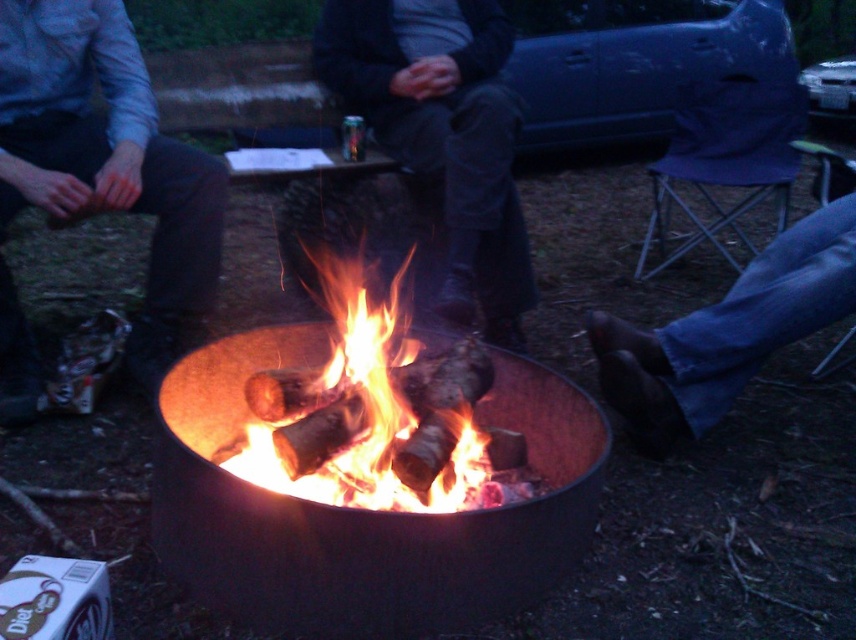
You are standing in the outdoor scene with the fire pit. There are two points marked in the image. Which point is closer to you, point [10,80] or point [348,420]?

Point [10,80] is closer to you because it is further to the viewer than point [348,420].

You are planning to place a decorative stone on the black metal fire pit at center. However, you notice the dark gray sweater at center nearby. Which object is larger in size, making it more suitable to place the stone on?

The dark gray sweater at center is larger than the black metal fire pit at center, so it would be more suitable to place the decorative stone on the dark gray sweater at center.